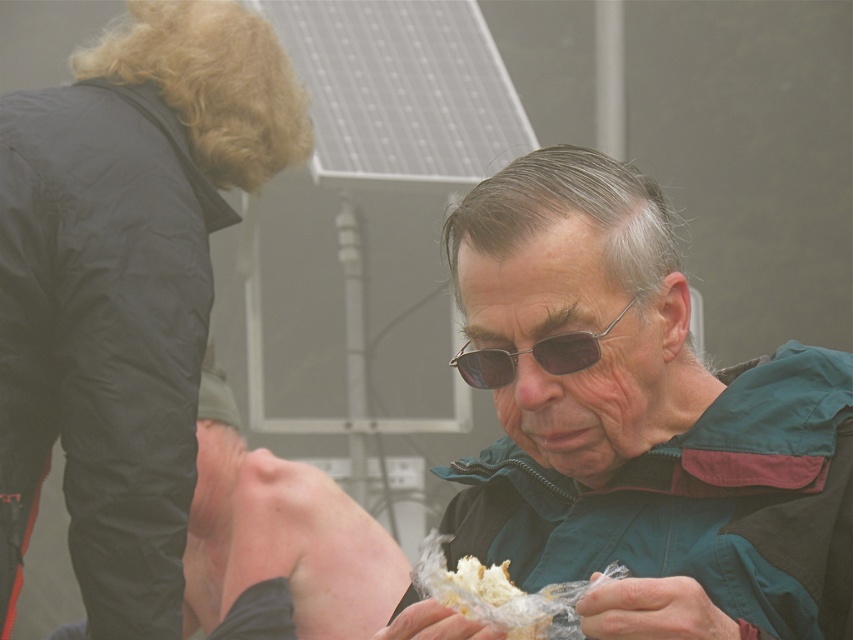
You are a photographer trying to capture a closeup of the white crumbly bread at center without including the green fabric jacket at center in the frame. Based on their positions, is this possible?

The green fabric jacket at center is to the right of white crumbly bread at center, so if you position your camera to the left side of the white crumbly bread at center, you can capture it without including the green fabric jacket at center in the frame.

You are a photographer trying to capture the green fabric jacket at center in your shot. The camera you are using has a focal length of 50mm and an aperture of f2.8. If you want to ensure the jacket is in focus, what is the minimum distance you need to be from the jacket based on the given coordinates?

The minimum distance required to ensure the green fabric jacket at center is in focus cannot be determined solely from the provided coordinates. Additional information such as sensor size, depth of field calculations, or real world dimensions would be necessary to calculate the exact distance.

You are a photographer standing at the center of the scene. You want to take a photo of both the black synthetic jacket at upper left and the older man in the foreground. Can you fit both subjects into the frame without moving your position?

The subjects are 2.75 meters apart. Since the photographer is at the center, the distance between them may be too wide to capture both in a single frame without moving.